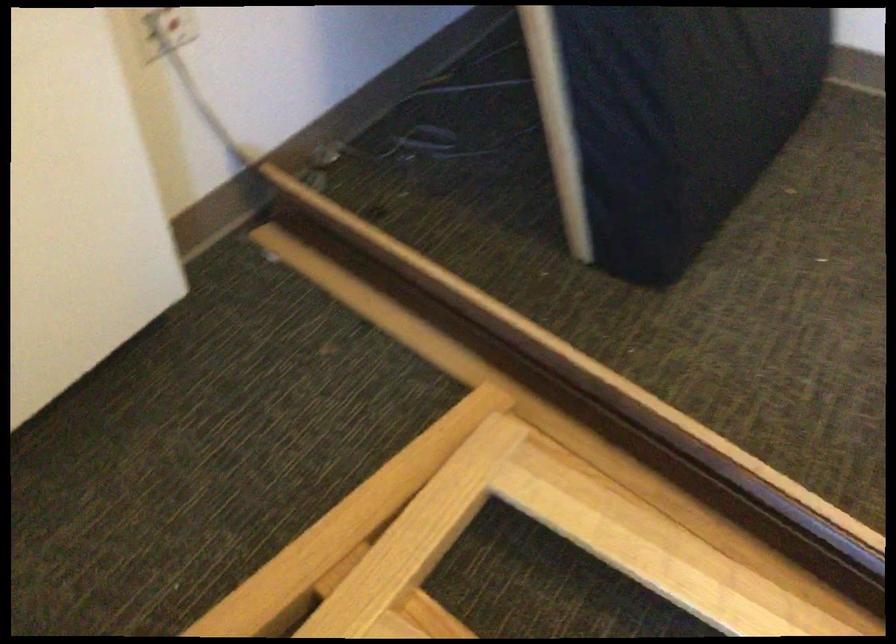
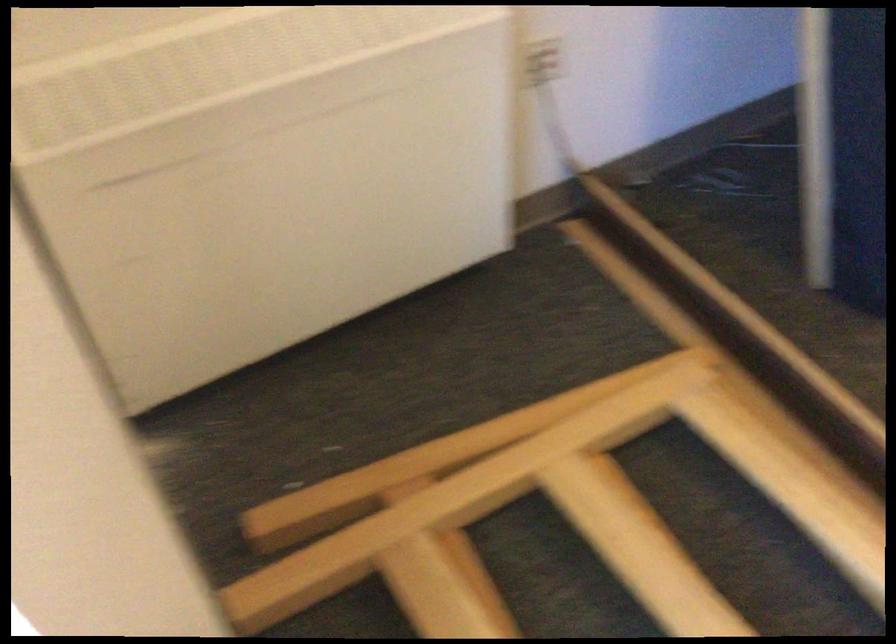
Locate, in the second image, the point that corresponds to (592,456) in the first image.

(777, 418)